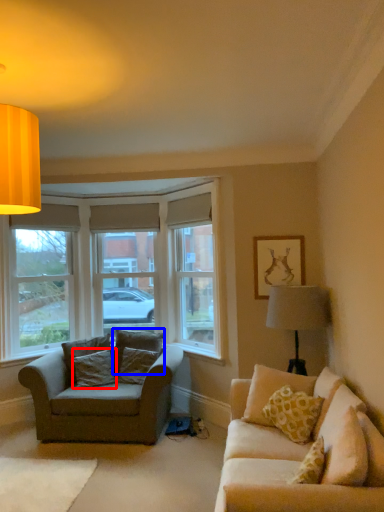
Question: Among these objects, which one is farthest to the camera, pillow (highlighted by a red box) or pillow (highlighted by a blue box)?

Choices:
 (A) pillow
 (B) pillow

Answer: (B)